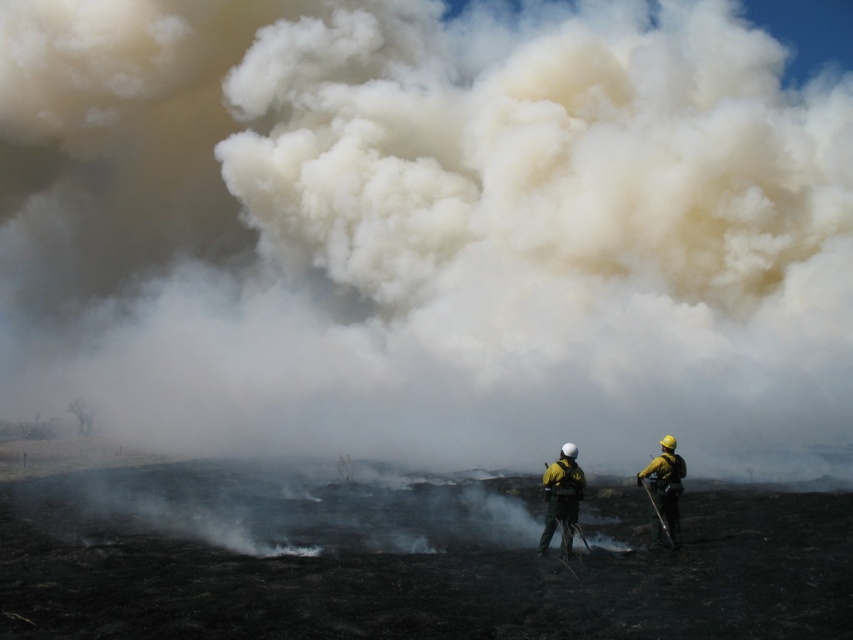
Question: Does white smoke at center have a smaller size compared to yellow hard hat at right?

Choices:
 (A) yes
 (B) no

Answer: (B)

Question: Considering the real-world distances, which object is closest to the yellow hard hat at right?

Choices:
 (A) yellow hard hat at center
 (B) white smoke at center

Answer: (A)

Question: Which object is the closest to the yellow hard hat at center?

Choices:
 (A) white smoke at center
 (B) yellow hard hat at right

Answer: (B)

Question: Which of the following is the farthest from the observer?

Choices:
 (A) (663, 500)
 (B) (334, 422)

Answer: (B)

Question: Does yellow hard hat at center come behind yellow hard hat at right?

Choices:
 (A) no
 (B) yes

Answer: (A)

Question: Can you confirm if white smoke at center is smaller than yellow hard hat at center?

Choices:
 (A) yes
 (B) no

Answer: (B)